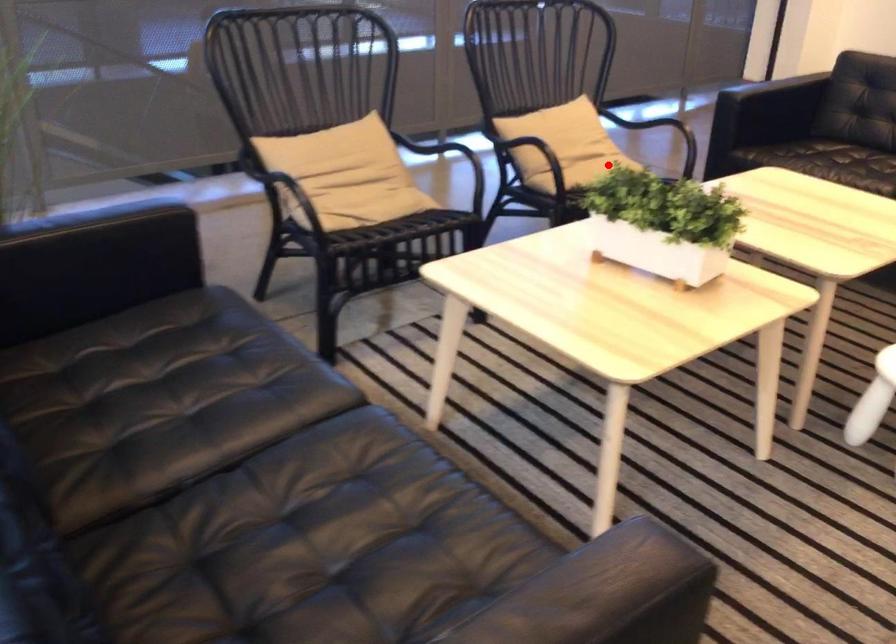
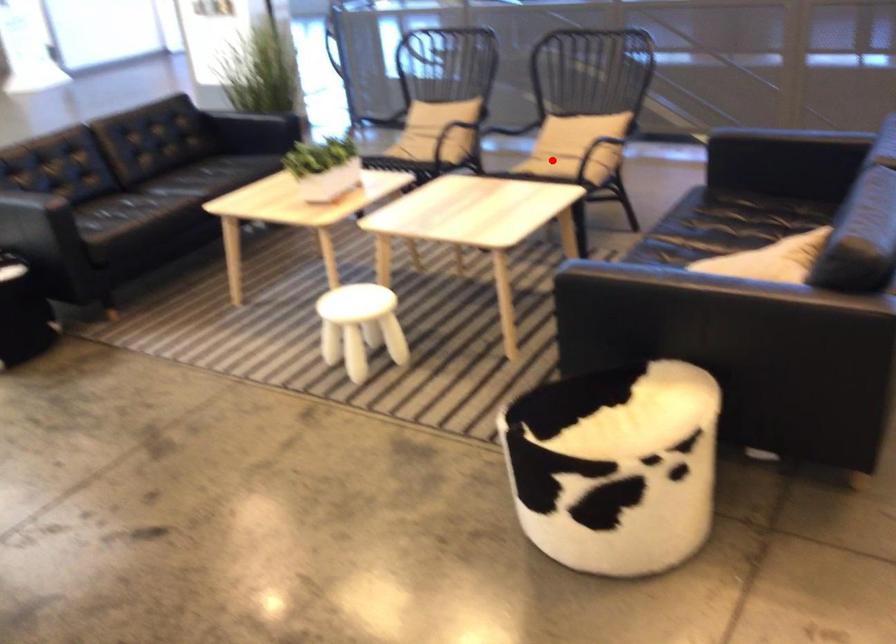
I am providing you with two images of the same scene from different viewpoints. A red point is marked on the first image and another point is marked on the second image. Does the point marked in image1 correspond to the same location as the one in image2?

Yes